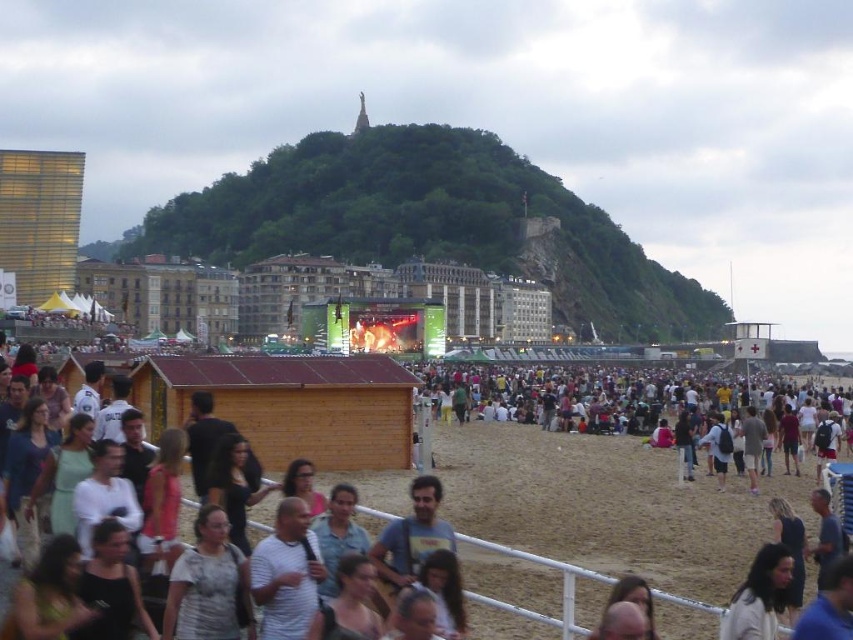
Question: Which point is closer to the camera?

Choices:
 (A) light brown hair at lower right
 (B) dark brown sand at center
 (C) wooden hut at center

Answer: (C)

Question: Can you confirm if wooden hut at center is positioned above dark brown sand at center?

Choices:
 (A) yes
 (B) no

Answer: (A)

Question: Does wooden hut at center appear on the left side of dark brown sand at center?

Choices:
 (A) yes
 (B) no

Answer: (A)

Question: Does wooden hut at center have a smaller size compared to light brown hair at lower right?

Choices:
 (A) no
 (B) yes

Answer: (A)

Question: Among these points, which one is nearest to the camera?

Choices:
 (A) (334, 397)
 (B) (737, 611)
 (C) (428, 387)

Answer: (B)

Question: Among these objects, which one is nearest to the camera?

Choices:
 (A) light brown hair at lower right
 (B) dark brown sand at center

Answer: (A)